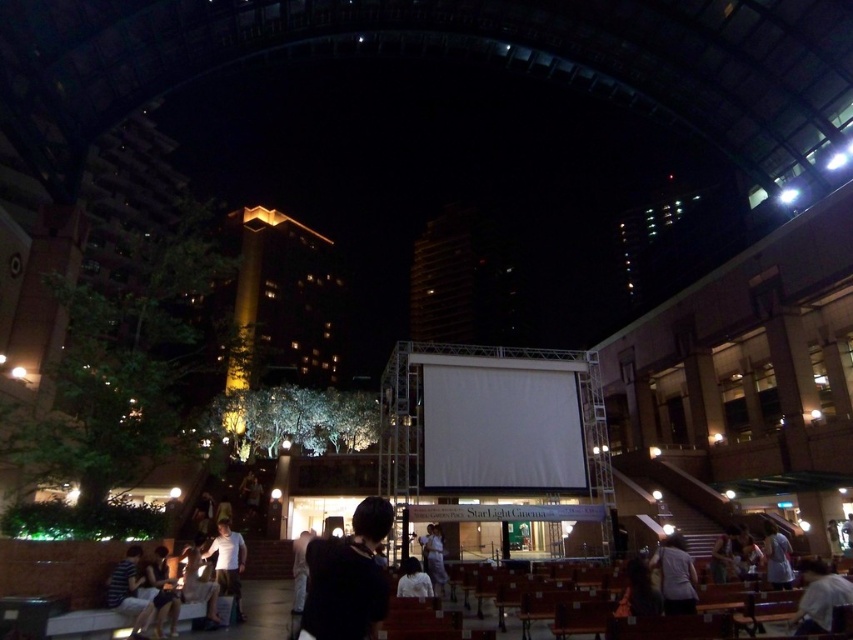
Question: Which of the following is the farthest from the observer?

Choices:
 (A) (674, 554)
 (B) (213, 573)

Answer: (B)

Question: Can you confirm if black matte shirt at center is positioned to the right of white fabric dress at center?

Choices:
 (A) no
 (B) yes

Answer: (A)

Question: Can you confirm if light brown fabric shirt at lower right is positioned to the right of white fabric dress at center?

Choices:
 (A) yes
 (B) no

Answer: (B)

Question: Is dark gray fabric shirt at center wider than white cotton shirt at lower center?

Choices:
 (A) yes
 (B) no

Answer: (A)

Question: Estimate the real-world distances between objects in this image. Which object is closer to the white fabric dress at center?

Choices:
 (A) black matte shirt at center
 (B) white cotton shirt at lower center
 (C) light purple fabric at center

Answer: (C)

Question: Which object appears farthest from the camera in this image?

Choices:
 (A) light brown fabric shirt at lower right
 (B) white fabric shirt at center
 (C) black matte shirt at center

Answer: (B)